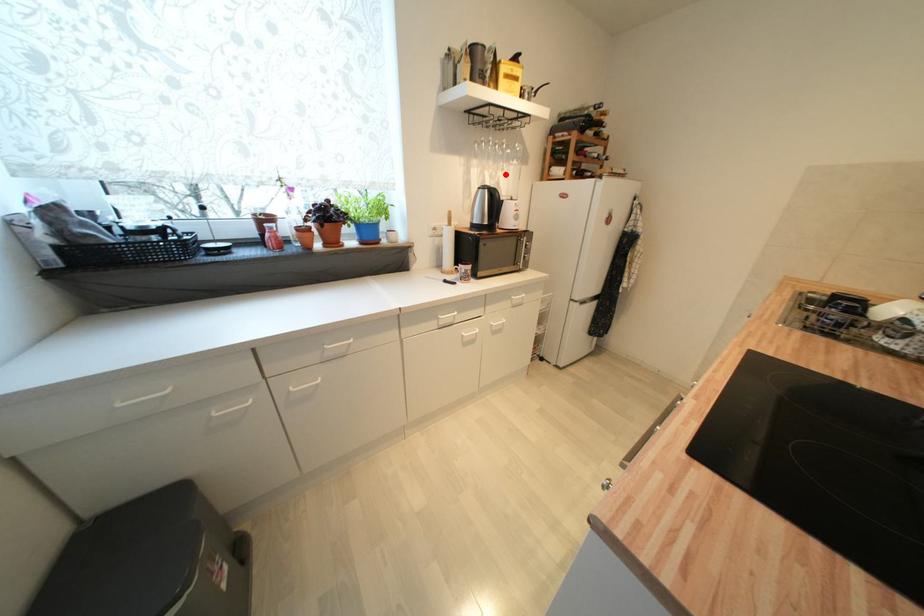
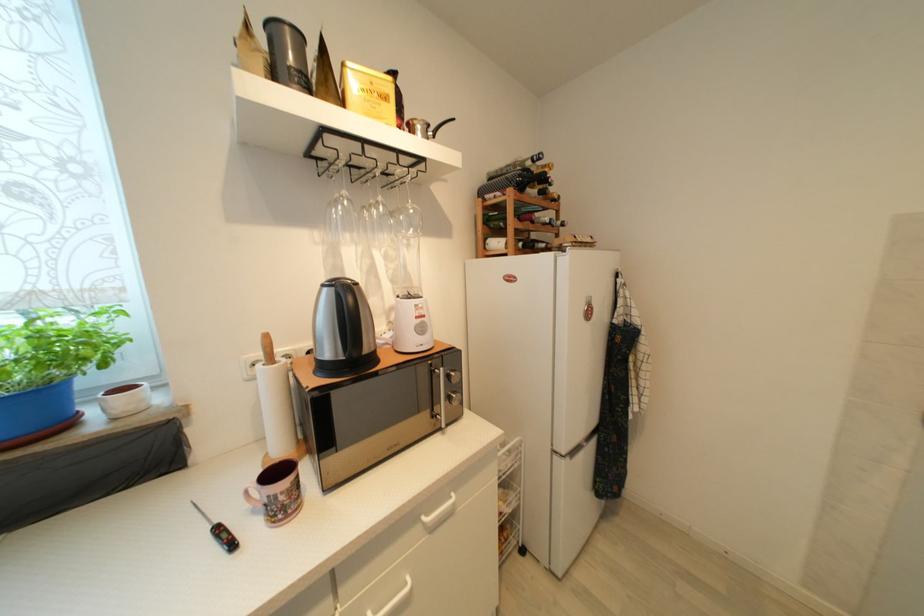
Find the pixel in the second image that matches the highlighted location in the first image.

(409, 253)